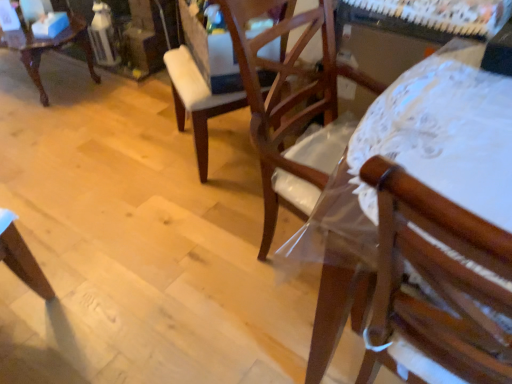
The height and width of the screenshot is (384, 512). I want to click on vacant space to the left of wooden chair at center, which ranks as the second chair in front-to-back order, so click(151, 142).